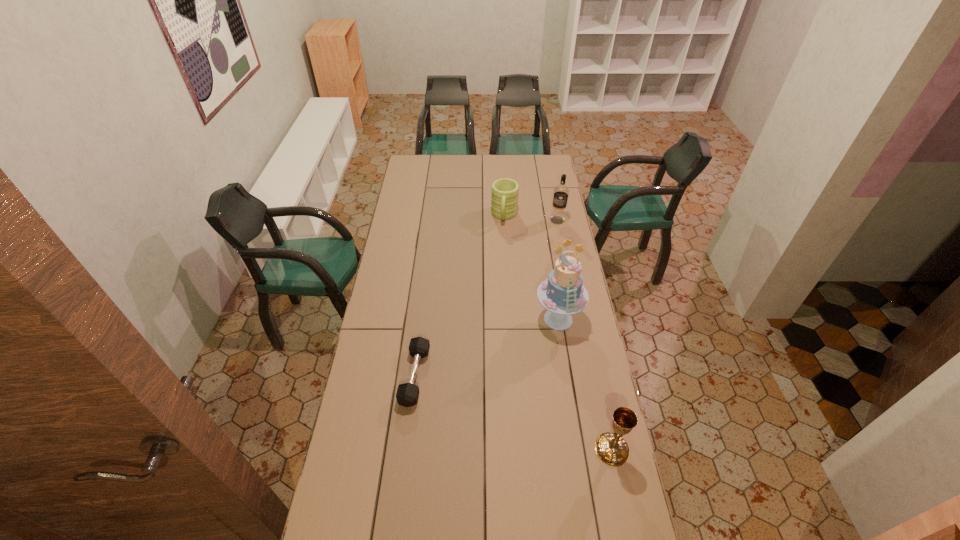
At what (x,y) coordinates should I click in order to perform the action: click on chalice that is at the right edge. Please return your answer as a coordinate pair (x, y). The image size is (960, 540). Looking at the image, I should click on (611, 448).

Find the location of a particular element. The height and width of the screenshot is (540, 960). cake at the right edge is located at coordinates (562, 293).

Identify the location of vodka positioned at the right edge. (561, 192).

In the image, there is a desktop. Where is `vacant space at the near edge`? This screenshot has height=540, width=960. vacant space at the near edge is located at coordinates (416, 503).

I want to click on vacant space at the left edge, so click(x=376, y=347).

You are a GUI agent. You are given a task and a screenshot of the screen. Output one action in this format:
    pyautogui.click(x=<x>, y=<y>)
    Task: Click on the vacant area at the right edge of the desktop
    The image size is (960, 540).
    Given the screenshot: What is the action you would take?
    pyautogui.click(x=555, y=261)

Locate an element on the screen. Image resolution: width=960 pixels, height=540 pixels. free space at the far right corner of the desktop is located at coordinates (529, 165).

At what (x,y) coordinates should I click in order to perform the action: click on free space between the shortest object and the third nearest object. Please return your answer as a coordinate pair (x, y). The image size is (960, 540). Looking at the image, I should click on 487,347.

This screenshot has height=540, width=960. Find the location of `free space between the third tallest object and the tallest object`. free space between the third tallest object and the tallest object is located at coordinates (585, 384).

The height and width of the screenshot is (540, 960). In order to click on free space between the third nearest object and the second shortest object in this screenshot , I will do `click(531, 267)`.